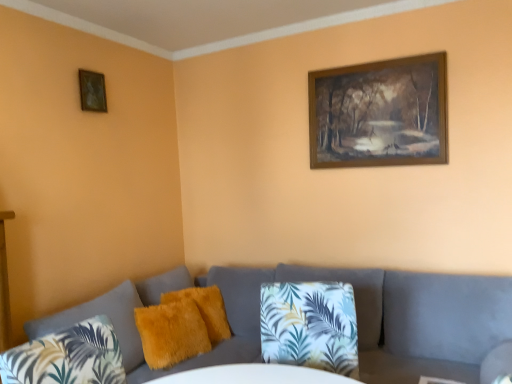
The image size is (512, 384). In order to click on empty space that is ontop of wooden frame at upper right, the 1th picture frame from the right (from a real-world perspective) in this screenshot , I will do `click(372, 62)`.